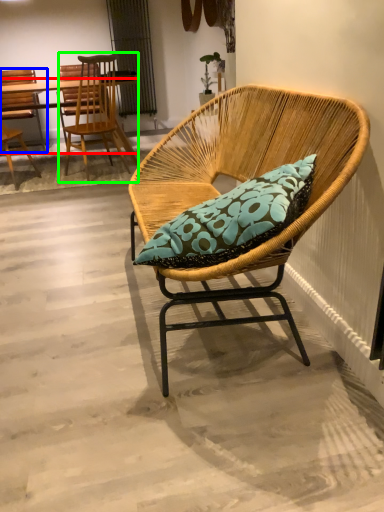
Question: Which object is the closest to the desk (highlighted by a red box)? Choose among these: chair (highlighted by a blue box) or chair (highlighted by a green box).

Choices:
 (A) chair
 (B) chair

Answer: (A)